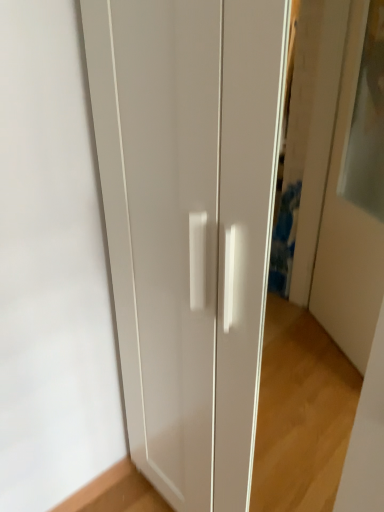
What is the approximate width of white matte door at center?

white matte door at center is 21.58 inches wide.

Where is `white matte door at center`? white matte door at center is located at coordinates (189, 225).

What do you see at coordinates (189, 225) in the screenshot? This screenshot has width=384, height=512. I see `white matte door at center` at bounding box center [189, 225].

At what (x,y) coordinates should I click in order to perform the action: click on white matte door at center. Please return your answer as a coordinate pair (x, y). The image size is (384, 512). Looking at the image, I should click on (189, 225).